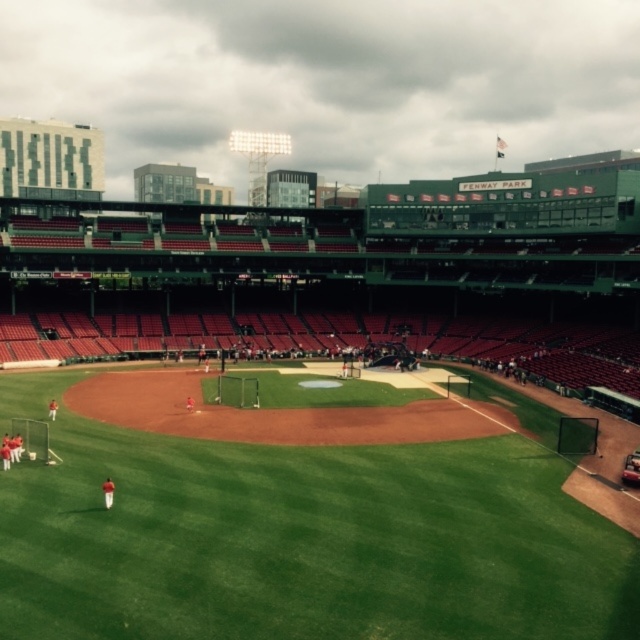
Does green grass field at center have a lesser width compared to orange uniformed players at lower left?

No, green grass field at center is not thinner than orange uniformed players at lower left.

Is green grass field at center smaller than orange uniformed players at lower left?

Incorrect, green grass field at center is not smaller in size than orange uniformed players at lower left.

Measure the distance between point (172, 497) and camera.

Point (172, 497) is 31.69 meters from camera.

At what (x,y) coordinates should I click in order to perform the action: click on green grass field at center. Please return your answer as a coordinate pair (x, y). The width and height of the screenshot is (640, 640). Looking at the image, I should click on (305, 541).